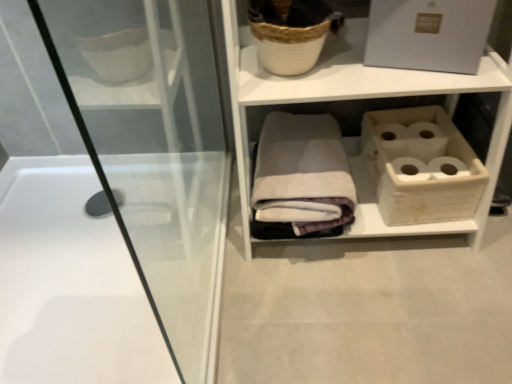
Question: Is white glossy bathtub at left located outside gray cotton bath towel at center?

Choices:
 (A) yes
 (B) no

Answer: (A)

Question: Are white glossy bathtub at left and gray cotton bath towel at center making contact?

Choices:
 (A) yes
 (B) no

Answer: (B)

Question: Is white glossy bathtub at left aimed at gray cotton bath towel at center?

Choices:
 (A) yes
 (B) no

Answer: (B)

Question: Can you confirm if white glossy bathtub at left is thinner than gray cotton bath towel at center?

Choices:
 (A) yes
 (B) no

Answer: (B)

Question: Can you confirm if white glossy bathtub at left is smaller than gray cotton bath towel at center?

Choices:
 (A) yes
 (B) no

Answer: (B)

Question: Is white woven basket at upper center situated inside white glossy bathtub at left or outside?

Choices:
 (A) outside
 (B) inside

Answer: (A)

Question: Considering the positions of white woven basket at upper center and white glossy bathtub at left in the image, is white woven basket at upper center taller or shorter than white glossy bathtub at left?

Choices:
 (A) short
 (B) tall

Answer: (B)

Question: Considering the positions of white woven basket at upper center and white glossy bathtub at left in the image, is white woven basket at upper center wider or thinner than white glossy bathtub at left?

Choices:
 (A) thin
 (B) wide

Answer: (A)

Question: From a real-world perspective, is white woven basket at upper center above or below white glossy bathtub at left?

Choices:
 (A) above
 (B) below

Answer: (A)

Question: Is white woven basket at upper center inside the boundaries of gray cotton bath towel at center, or outside?

Choices:
 (A) inside
 (B) outside

Answer: (B)

Question: Relative to gray cotton bath towel at center, is white woven basket at upper center in front or behind?

Choices:
 (A) behind
 (B) front

Answer: (B)

Question: In terms of height, does white woven basket at upper center look taller or shorter compared to gray cotton bath towel at center?

Choices:
 (A) short
 (B) tall

Answer: (B)

Question: From a real-world perspective, is white woven basket at upper center physically located above or below gray cotton bath towel at center?

Choices:
 (A) below
 (B) above

Answer: (B)

Question: In the image, is gray cotton bath towel at center positioned in front of or behind white woven basket at upper center?

Choices:
 (A) behind
 (B) front

Answer: (A)

Question: Considering the relative positions of gray cotton bath towel at center and white woven basket at upper center in the image provided, is gray cotton bath towel at center to the left or to the right of white woven basket at upper center?

Choices:
 (A) left
 (B) right

Answer: (A)